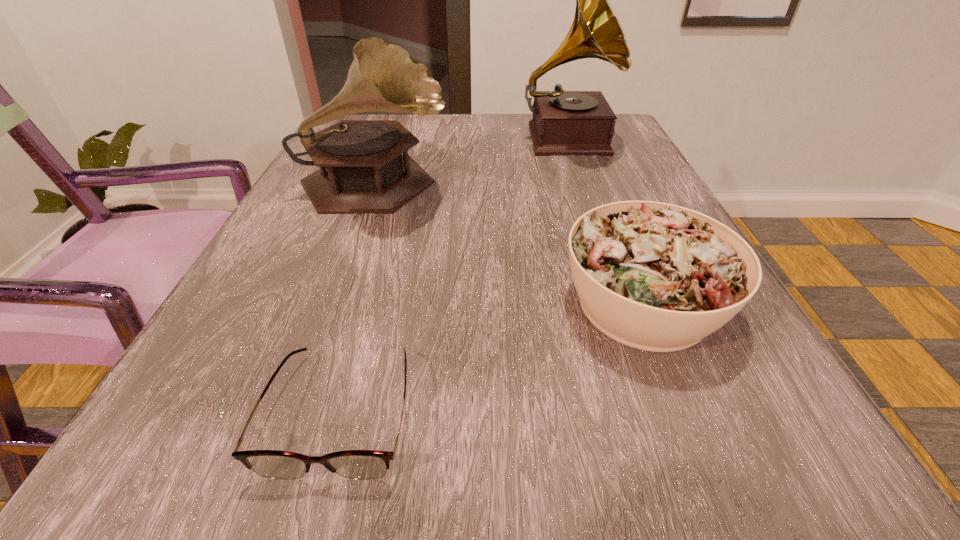
Where is `the tallest object`? the tallest object is located at coordinates (564, 122).

You are a GUI agent. You are given a task and a screenshot of the screen. Output one action in this format:
    pyautogui.click(x=<x>, y=<y>)
    Task: Click on the taller phonograph record
    The image size is (960, 540).
    Given the screenshot: What is the action you would take?
    pyautogui.click(x=564, y=122)

Find the location of a particular element. Image resolution: width=960 pixels, height=540 pixels. the third shortest object is located at coordinates (362, 169).

What are the coordinates of `the left phonograph record` in the screenshot? It's located at (362, 169).

Locate an element on the screen. This screenshot has width=960, height=540. salad is located at coordinates (658, 277).

Locate an element on the screen. spectacles is located at coordinates (354, 464).

This screenshot has width=960, height=540. Find the location of `vacant area situated from the horn of the tallest object`. vacant area situated from the horn of the tallest object is located at coordinates (615, 282).

You are a GUI agent. You are given a task and a screenshot of the screen. Output one action in this format:
    pyautogui.click(x=<x>, y=<y>)
    Task: Click on the vacant space located 0.090m on the horn direction of the second tallest object
    This screenshot has height=540, width=960.
    Given the screenshot: What is the action you would take?
    pyautogui.click(x=494, y=187)

The image size is (960, 540). I want to click on vacant space positioned on the back of the salad, so click(x=595, y=183).

This screenshot has width=960, height=540. Identify the location of object situated at the far edge. (564, 122).